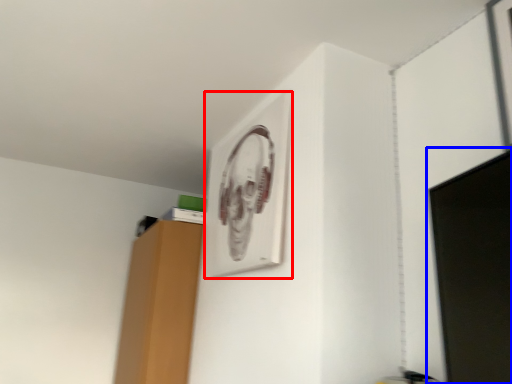
Question: Which object is closer to the camera taking this photo, picture frame (highlighted by a red box) or computer monitor (highlighted by a blue box)?

Choices:
 (A) picture frame
 (B) computer monitor

Answer: (B)